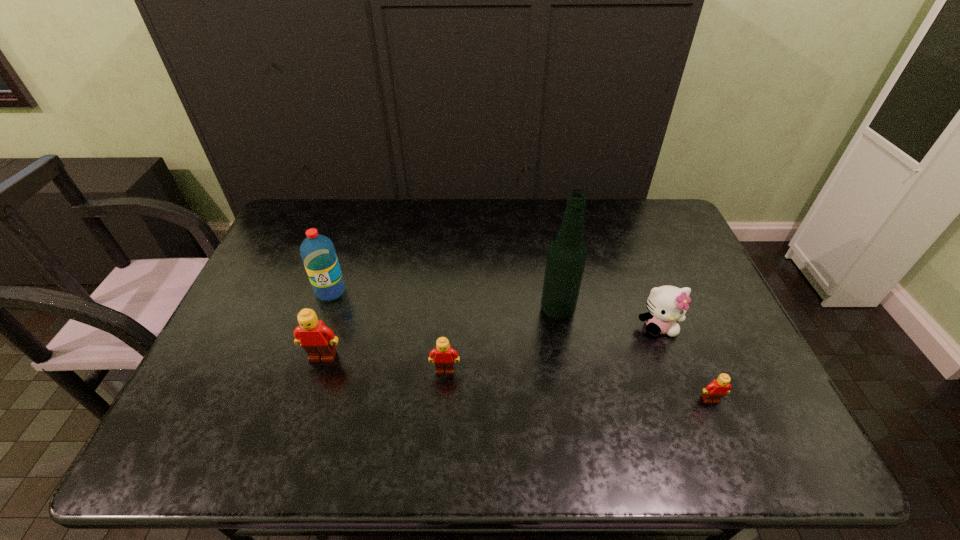
Identify the location of vacant space located 0.080m on the face of the fourth farthest object. This screenshot has width=960, height=540. (312, 392).

Where is `vacant space positioned 0.080m on the face of the fifth farthest object`? This screenshot has width=960, height=540. vacant space positioned 0.080m on the face of the fifth farthest object is located at coordinates (443, 404).

The width and height of the screenshot is (960, 540). I want to click on free location located 0.250m on the front label of the water bottle, so click(301, 376).

Locate an element on the screen. This screenshot has height=540, width=960. vacant region located on the front-facing side of the kitten is located at coordinates (680, 382).

Locate an element on the screen. This screenshot has height=540, width=960. vacant space located on the right of the fourth object from left to right is located at coordinates (624, 310).

This screenshot has height=540, width=960. Find the location of `object that is at the near edge`. object that is at the near edge is located at coordinates (718, 388).

Identify the location of Lego that is positioned at the right edge. (718, 388).

In order to click on kitten located at the right edge in this screenshot , I will do `click(666, 304)`.

Where is `object that is at the near right corner`? This screenshot has width=960, height=540. object that is at the near right corner is located at coordinates (718, 388).

In the image, there is a desktop. Where is `vacant space at the far edge`? The width and height of the screenshot is (960, 540). vacant space at the far edge is located at coordinates (384, 228).